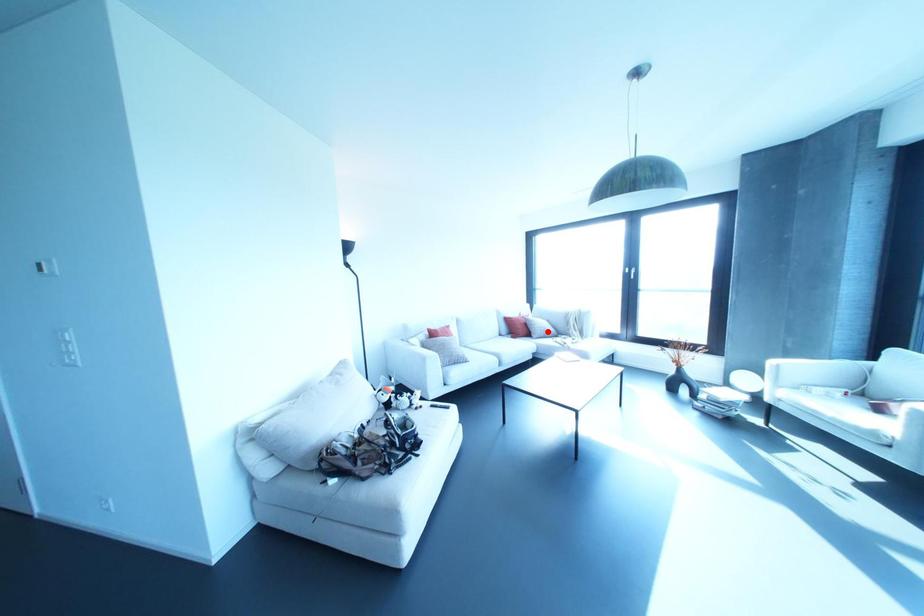
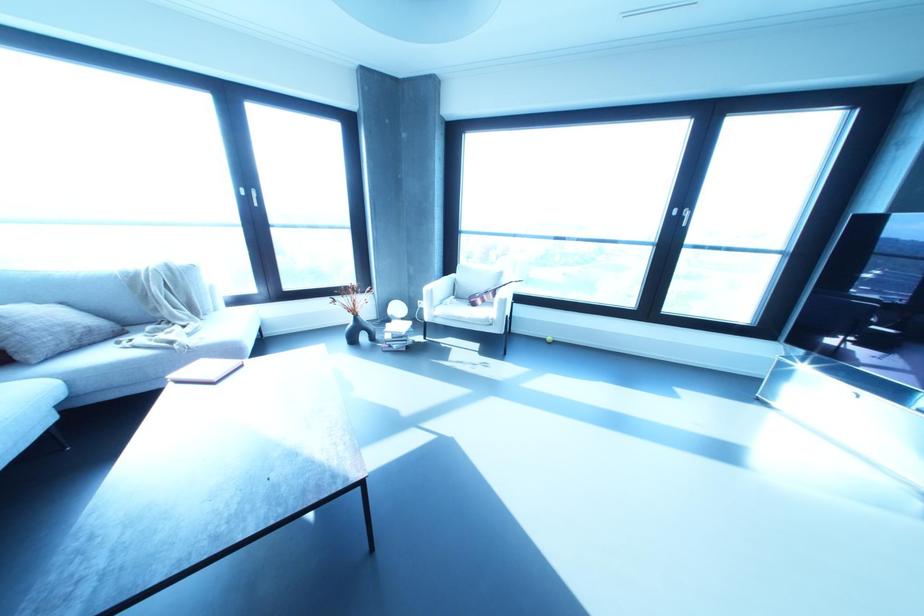
Where in the second image is the point corresponding to the highlighted location from the first image?

(90, 330)